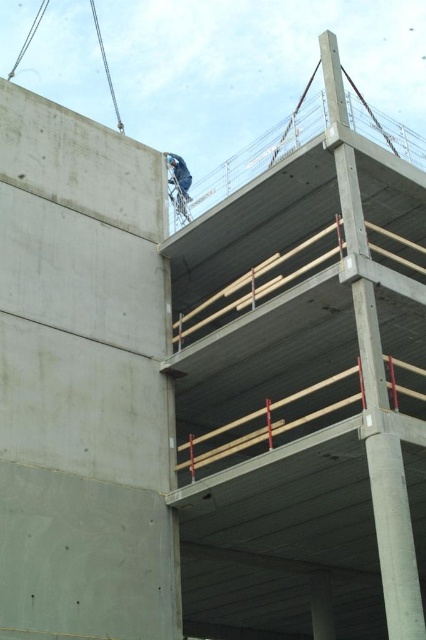
I want to click on smooth concrete at upper left, so click(81, 381).

Is point (6, 166) in front of point (178, 177)?

Yes, point (6, 166) is in front of point (178, 177).

Between point (69, 262) and point (184, 195), which one is positioned in front?

Positioned in front is point (69, 262).

Locate an element on the screen. smooth concrete at upper left is located at coordinates (81, 381).